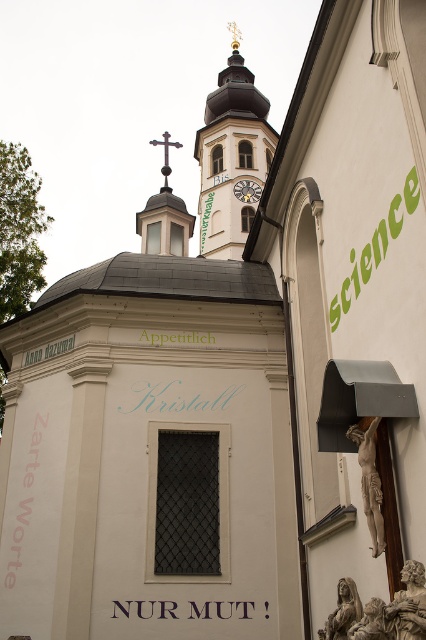
In the scene shown: Is matte stone statue at center right above green painted text at upper center?

No.

Between point (371, 464) and point (207, 212), which one is positioned behind?

Positioned behind is point (207, 212).

Which is behind, point (382, 516) or point (207, 209)?

The point (207, 209) is more distant.

This screenshot has width=426, height=640. I want to click on matte stone statue at center right, so click(x=370, y=481).

Who is higher up, matte brown text at center or green painted text at upper center?

green painted text at upper center is above.

Does matte brown text at center appear under green painted text at upper center?

Correct, matte brown text at center is located below green painted text at upper center.

Who is more forward, (141, 333) or (207, 198)?

Point (141, 333) is in front.

Where is `matte brown text at center`? The height and width of the screenshot is (640, 426). matte brown text at center is located at coordinates (178, 337).

Is metallic cross at upper center to the right of polished dark wood crucifix at center from the viewer's perspective?

Indeed, metallic cross at upper center is positioned on the right side of polished dark wood crucifix at center.

Locate an element on the screen. The width and height of the screenshot is (426, 640). metallic cross at upper center is located at coordinates (164, 214).